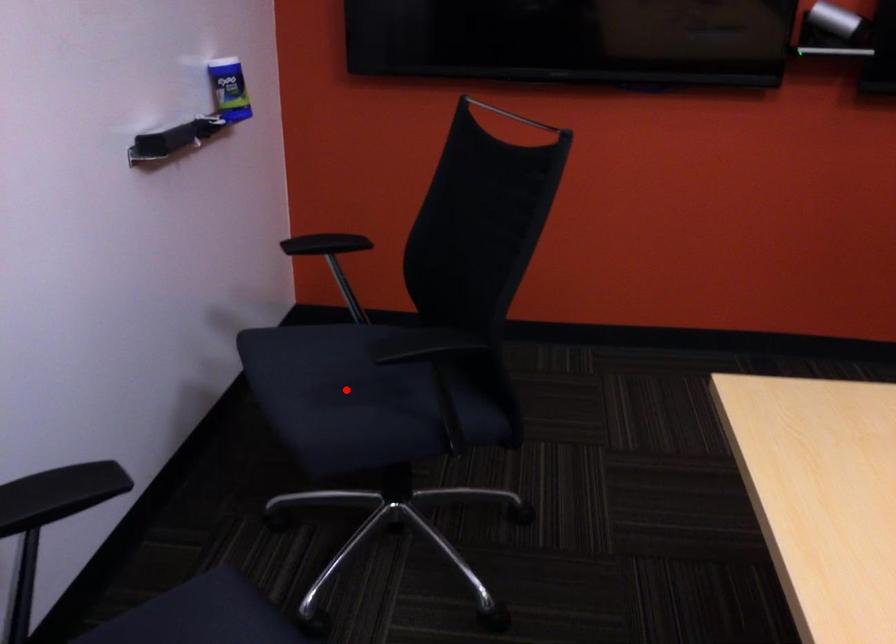
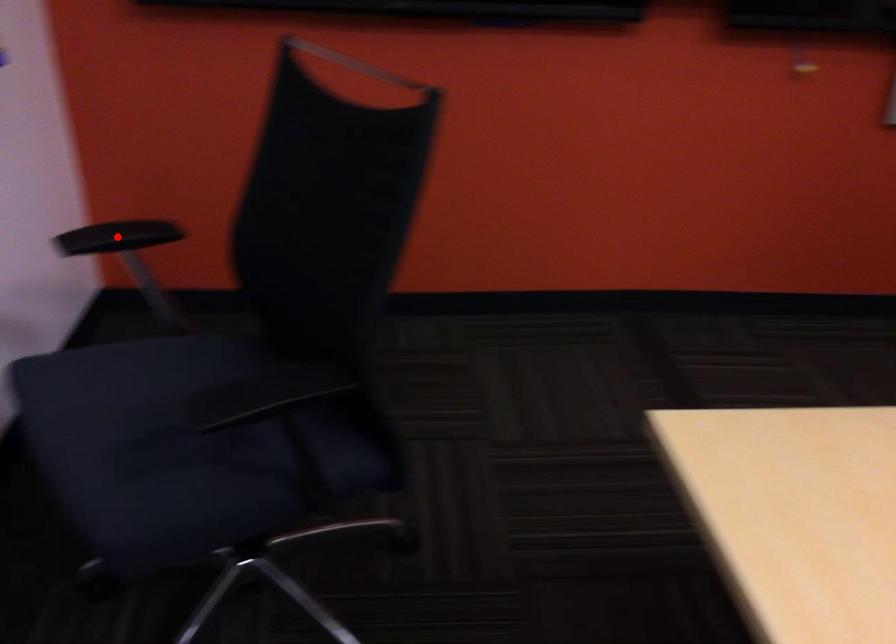
I am providing you with two images of the same scene from different viewpoints. A red point is marked on the first image and another point is marked on the second image. Is the marked point in image1 the same physical position as the marked point in image2?

→ No